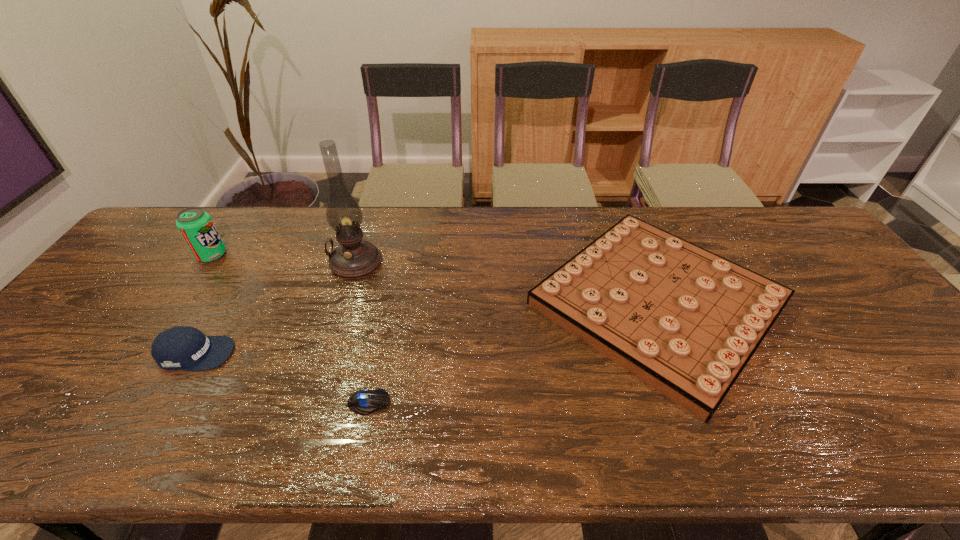
Identify the location of vacant region at the right edge of the desktop. (841, 289).

In the image, there is a desktop. Identify the location of free space at the far left corner. The image size is (960, 540). (163, 225).

I want to click on vacant region at the far right corner of the desktop, so click(765, 205).

This screenshot has height=540, width=960. What are the coordinates of `vacant space in between the pop soda and the computer mouse` in the screenshot? It's located at (x=290, y=329).

At what (x,y) coordinates should I click in order to perform the action: click on free area in between the baseball cap and the computer mouse. Please return your answer as a coordinate pair (x, y). Looking at the image, I should click on (282, 378).

Identify the location of free space that is in between the computer mouse and the gameboard. This screenshot has height=540, width=960. (513, 353).

This screenshot has height=540, width=960. I want to click on empty space between the tallest object and the shortest object, so click(362, 333).

The width and height of the screenshot is (960, 540). What are the coordinates of `empty space that is in between the rightmost object and the third object from left to right` in the screenshot? It's located at (506, 283).

What are the coordinates of `empty location between the rightmost object and the fourth shortest object` in the screenshot? It's located at (435, 279).

At what (x,y) coordinates should I click in order to perform the action: click on free area in between the baseball cap and the pop soda. Please return your answer as a coordinate pair (x, y). Looking at the image, I should click on (204, 305).